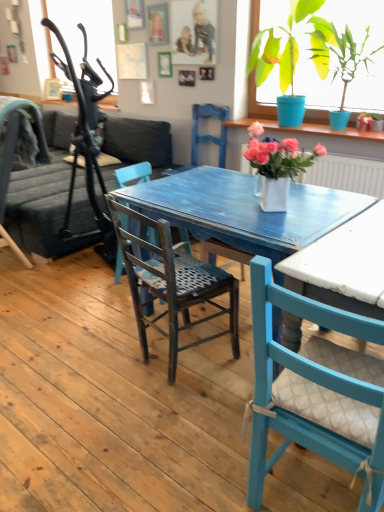
Question: Can you confirm if matte blue chair with cushion at center, the first chair positioned from the right, is wider than green glossy plant at upper right, the second houseplant when ordered from bottom to top?

Choices:
 (A) yes
 (B) no

Answer: (A)

Question: From a real-world perspective, is matte blue chair with cushion at center, which is the first chair from front to back, over green glossy plant at upper right, the 1th houseplant when ordered from back to front?

Choices:
 (A) yes
 (B) no

Answer: (B)

Question: Considering the relative positions of matte blue chair with cushion at center, which is the first chair from front to back, and green glossy plant at upper right, positioned as the first houseplant in right-to-left order, in the image provided, is matte blue chair with cushion at center, which is the first chair from front to back, to the left of green glossy plant at upper right, positioned as the first houseplant in right-to-left order, from the viewer's perspective?

Choices:
 (A) yes
 (B) no

Answer: (A)

Question: From the image's perspective, is matte blue chair with cushion at center, placed as the 3th chair when sorted from left to right, under green glossy plant at upper right, the 1th houseplant when ordered from back to front?

Choices:
 (A) yes
 (B) no

Answer: (A)

Question: Considering the relative positions of matte blue chair with cushion at center, placed as the 3th chair when sorted from left to right, and green glossy plant at upper right, the second houseplant when ordered from bottom to top, in the image provided, is matte blue chair with cushion at center, placed as the 3th chair when sorted from left to right, behind green glossy plant at upper right, the second houseplant when ordered from bottom to top,?

Choices:
 (A) no
 (B) yes

Answer: (A)

Question: Can you confirm if matte blue chair with cushion at center, placed as the 3th chair when sorted from left to right, is thinner than green glossy plant at upper right, the second houseplant when ordered from bottom to top?

Choices:
 (A) yes
 (B) no

Answer: (B)

Question: Is matte blue chair with cushion at center, placed as the 3th chair when sorted from left to right, facing away from dark gray fabric couch at left?

Choices:
 (A) yes
 (B) no

Answer: (B)

Question: Can dark gray fabric couch at left be found inside matte blue chair with cushion at center, which is the first chair from front to back?

Choices:
 (A) yes
 (B) no

Answer: (B)

Question: From a real-world perspective, is matte blue chair with cushion at center, which is the first chair from front to back, beneath dark gray fabric couch at left?

Choices:
 (A) no
 (B) yes

Answer: (A)

Question: Is matte blue chair with cushion at center, the 3th chair when ordered from back to front, to the left of dark gray fabric couch at left from the viewer's perspective?

Choices:
 (A) no
 (B) yes

Answer: (A)

Question: Could you tell me if matte blue chair with cushion at center, which is the first chair from front to back, is turned towards dark gray fabric couch at left?

Choices:
 (A) yes
 (B) no

Answer: (B)

Question: Does matte blue chair with cushion at center, the 3th chair when ordered from back to front, come behind dark gray fabric couch at left?

Choices:
 (A) no
 (B) yes

Answer: (A)

Question: Is white ceramic vase at center, which ranks as the 2th houseplant in top-to-bottom order, at the left side of dark gray fabric couch at left?

Choices:
 (A) no
 (B) yes

Answer: (A)